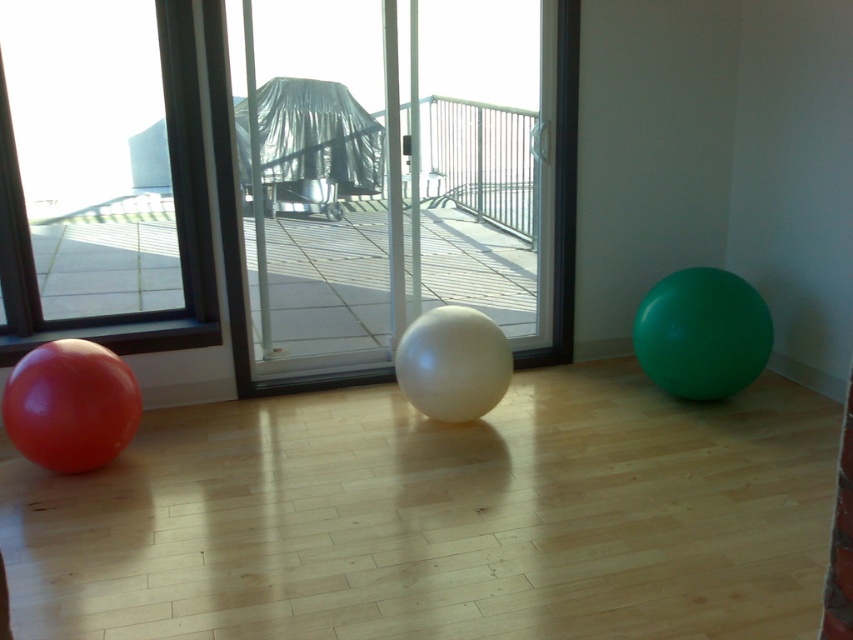
Consider the image. You are setting up decorations for a party. You have a metallic silver rail at center and a matte red balloon at left. Which object requires more space to place horizontally?

The metallic silver rail at center requires more space to place horizontally because its width is larger than the matte red balloon at left.

You are standing at the sliding glass doors and want to pick up the green rubber ball at right and the white glossy ball at center. Which ball should you move first to reach the one farther away?

You should move the green rubber ball at right first because it is closer to you than the white glossy ball at center, so removing it first allows access to the one further away.